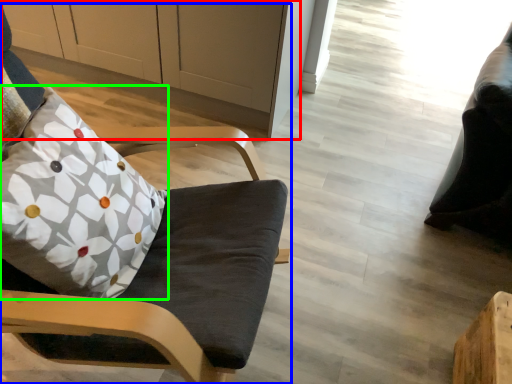
Question: Which object is positioned closest to cabinetry (highlighted by a red box)? Select from chair (highlighted by a blue box) and pillow (highlighted by a green box).

Choices:
 (A) chair
 (B) pillow

Answer: (A)